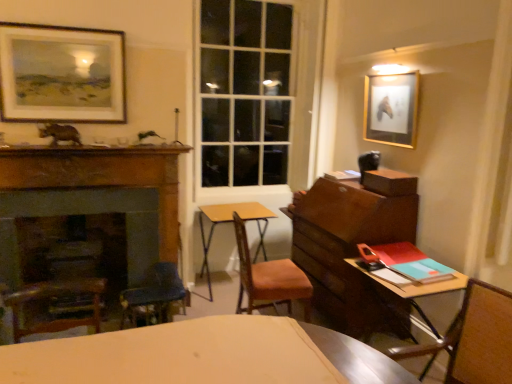
Find the location of a particular element. The image size is (512, 384). vacant area on top of matte black picture frame at upper left, which is the 1th picture frame from left to right (from a real-world perspective) is located at coordinates (61, 28).